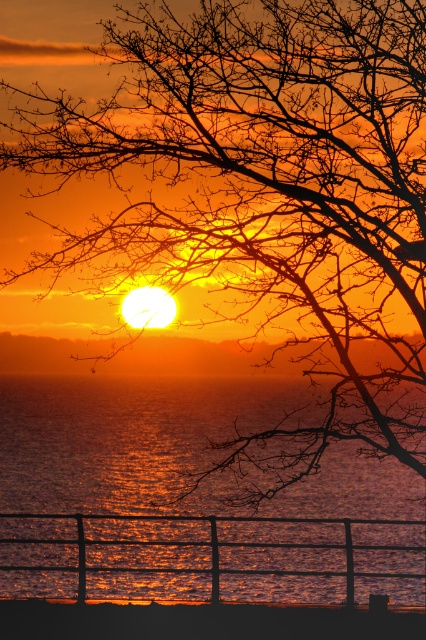
Question: Is glistening water at lower center smaller than orange matte horizon at center?

Choices:
 (A) no
 (B) yes

Answer: (A)

Question: Is glistening water at lower center to the right of orange matte horizon at center from the viewer's perspective?

Choices:
 (A) no
 (B) yes

Answer: (B)

Question: Which object is farther from the camera taking this photo?

Choices:
 (A) orange matte horizon at center
 (B) glistening water at lower center

Answer: (B)

Question: In this image, where is glistening water at lower center located relative to orange matte horizon at center?

Choices:
 (A) right
 (B) left

Answer: (A)